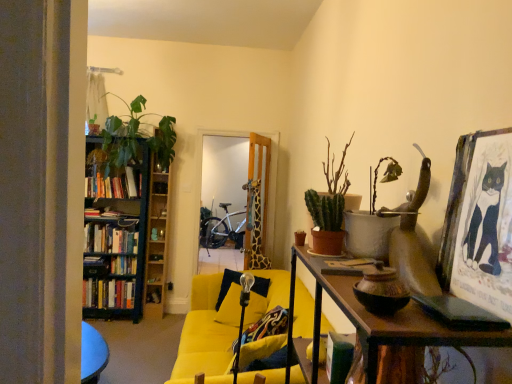
Question: Considering the relative sizes of hardcover books at left, which is the 2th book from top to bottom, and green matte plant at upper right, the 1th houseplant from the front, in the image provided, is hardcover books at left, which is the 2th book from top to bottom, thinner than green matte plant at upper right, the 1th houseplant from the front,?

Choices:
 (A) no
 (B) yes

Answer: (A)

Question: Is hardcover books at left, acting as the second book starting from the bottom, closer to the viewer compared to green matte plant at upper right, arranged as the first houseplant when viewed from the right?

Choices:
 (A) yes
 (B) no

Answer: (B)

Question: Is hardcover books at left, which is the 2th book from top to bottom, wider than green matte plant at upper right, the 1th houseplant from the front?

Choices:
 (A) no
 (B) yes

Answer: (B)

Question: Are hardcover books at left, acting as the second book starting from the bottom, and green matte plant at upper right, placed as the fourth houseplant when sorted from left to right, located far from each other?

Choices:
 (A) yes
 (B) no

Answer: (A)

Question: Could you tell me if hardcover books at left, acting as the second book starting from the bottom, is facing green matte plant at upper right, arranged as the first houseplant when viewed from the right?

Choices:
 (A) no
 (B) yes

Answer: (B)

Question: Is hardcover books at left, which is the 2th book from top to bottom, positioned behind green matte plant at upper right, arranged as the first houseplant when viewed from the right?

Choices:
 (A) no
 (B) yes

Answer: (B)

Question: From the image's perspective, is green matte cactus at upper right, acting as the third houseplant starting from the front, on top of green matte cactus at center-right, which is the second houseplant in left-to-right order?

Choices:
 (A) no
 (B) yes

Answer: (B)

Question: Can you confirm if green matte cactus at upper right, which appears as the second houseplant when viewed from the right, is smaller than green matte cactus at center-right, which is the second houseplant in left-to-right order?

Choices:
 (A) yes
 (B) no

Answer: (B)

Question: Is green matte cactus at upper right, which appears as the second houseplant when viewed from the right, bigger than green matte cactus at center-right, which ranks as the third houseplant in right-to-left order?

Choices:
 (A) no
 (B) yes

Answer: (B)

Question: Is green matte cactus at upper right, the third houseplant from the left, further to camera compared to green matte cactus at center-right, which is the second houseplant in left-to-right order?

Choices:
 (A) yes
 (B) no

Answer: (A)

Question: Is green matte cactus at upper right, acting as the third houseplant starting from the front, positioned with its back to green matte cactus at center-right, positioned as the third houseplant in back-to-front order?

Choices:
 (A) no
 (B) yes

Answer: (A)

Question: Is green matte cactus at upper right, acting as the third houseplant starting from the front, to the left of green matte cactus at center-right, positioned as the third houseplant in back-to-front order, from the viewer's perspective?

Choices:
 (A) yes
 (B) no

Answer: (B)

Question: Is hardcover books at left, the 3th book in the top-to-bottom sequence, positioned far away from yellow fabric couch at center?

Choices:
 (A) yes
 (B) no

Answer: (A)